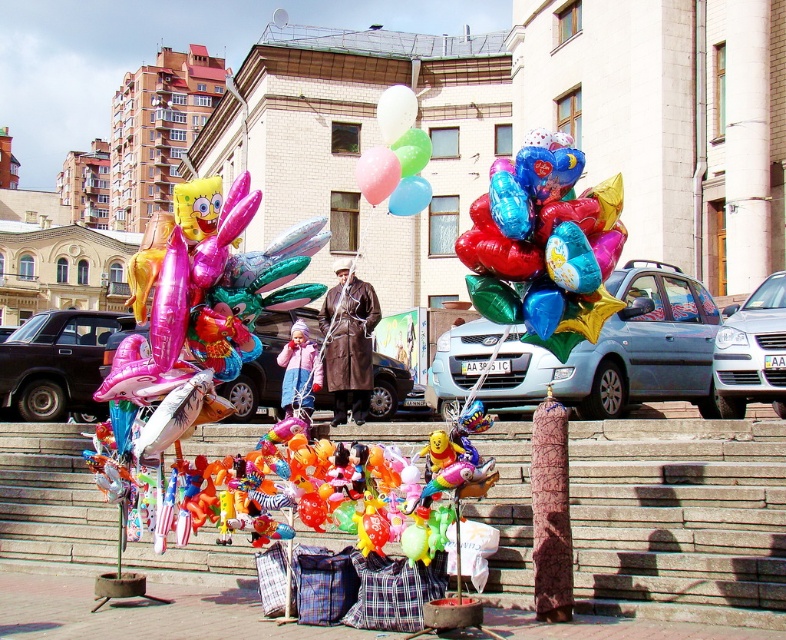
How much distance is there between translucent glossy balloons at center and translucent pink balloon at center?

translucent glossy balloons at center is 1.28 meters away from translucent pink balloon at center.

Is translucent glossy balloons at center shorter than translucent pink balloon at center?

In fact, translucent glossy balloons at center may be taller than translucent pink balloon at center.

Find the location of a particular element. translucent glossy balloons at center is located at coordinates (395, 156).

Where is `translucent glossy balloons at center`? Image resolution: width=786 pixels, height=640 pixels. translucent glossy balloons at center is located at coordinates (395, 156).

Who is taller, shiny metallic balloons at center or translucent blue balloon at center?

Standing taller between the two is shiny metallic balloons at center.

Between shiny metallic balloons at center and translucent blue balloon at center, which one appears on the right side from the viewer's perspective?

shiny metallic balloons at center is more to the right.

You are a GUI agent. You are given a task and a screenshot of the screen. Output one action in this format:
    pyautogui.click(x=<x>, y=<y>)
    Task: Click on the shiny metallic balloons at center
    
    Given the screenshot: What is the action you would take?
    pyautogui.click(x=544, y=244)

How much distance is there between brown leather coat at center and translucent plastic balloon at center?

brown leather coat at center and translucent plastic balloon at center are 30.16 feet apart from each other.

Identify the location of brown leather coat at center. The width and height of the screenshot is (786, 640). (347, 342).